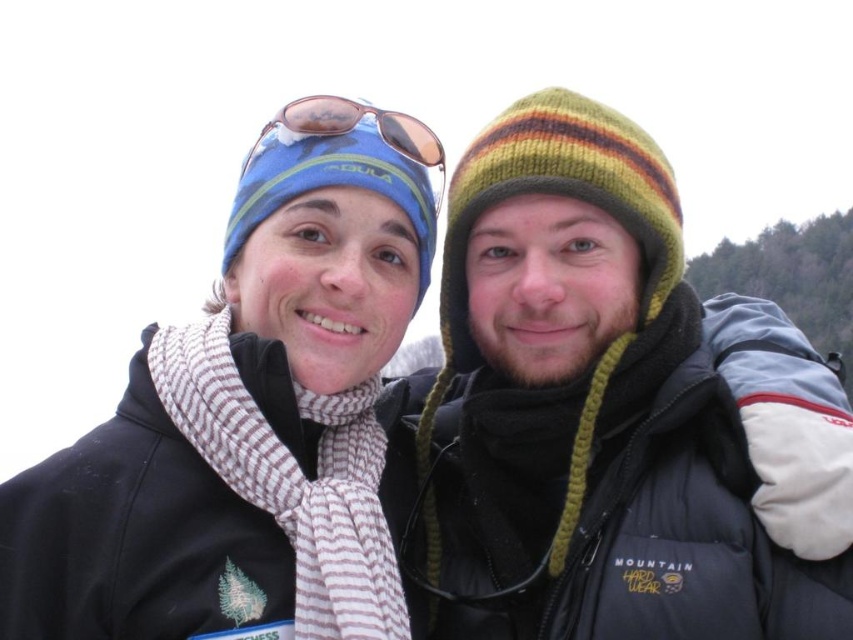
In the scene shown: You are taking a photo of the two people in the scene. You want to ensure that both the white striped scarf at center and the sunglasses at upper center are visible in the frame. Based on their positions, which object should be placed closer to the left side of the photo?

The sunglasses at upper center should be placed closer to the left side of the photo because the white striped scarf at center is to the right of the sunglasses at upper center.

You are a photographer trying to capture a closeup of the sunglasses at upper center while also including the white striped scarf at center in the frame. Given that your camera has a maximum zoom range that can capture objects up to 5 meters apart, will you be able to achieve this shot?

The white striped scarf at center and sunglasses at upper center are 6.75 meters apart, which exceeds the camera maximum zoom range of 5 meters. Therefore, you cannot capture both in the same frame.